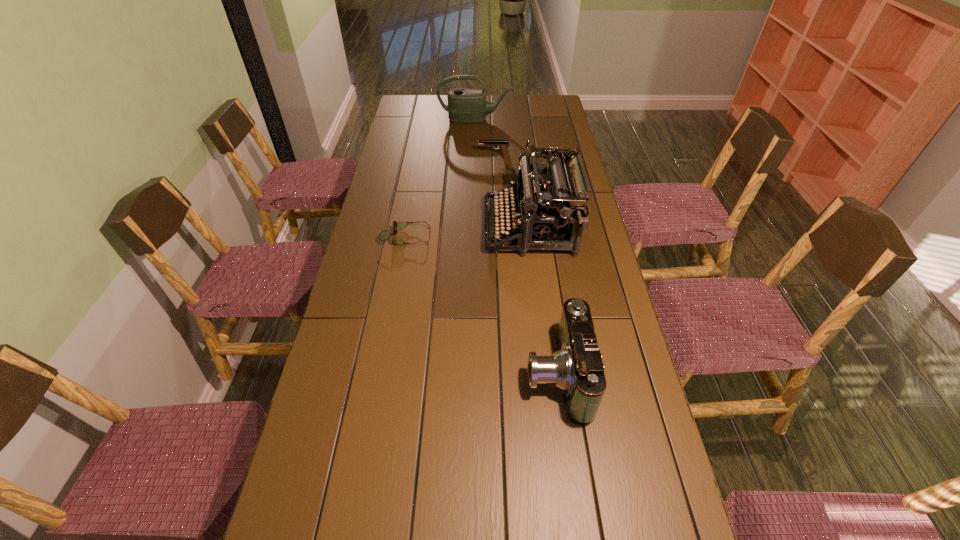
Where is `object present at the left edge`? This screenshot has width=960, height=540. object present at the left edge is located at coordinates (384, 235).

Find the location of `typewriter located at the right edge`. typewriter located at the right edge is located at coordinates (555, 212).

At what (x,y) coordinates should I click in order to perform the action: click on camcorder that is at the right edge. Please return your answer as a coordinate pair (x, y). This screenshot has width=960, height=540. Looking at the image, I should click on (576, 368).

Locate an element on the screen. free space at the far edge of the desktop is located at coordinates (529, 99).

You are a GUI agent. You are given a task and a screenshot of the screen. Output one action in this format:
    pyautogui.click(x=<x>, y=<y>)
    Task: Click on the vacant space at the left edge of the desktop
    The width and height of the screenshot is (960, 540).
    Given the screenshot: What is the action you would take?
    pyautogui.click(x=400, y=208)

The width and height of the screenshot is (960, 540). I want to click on free space at the right edge of the desktop, so click(x=565, y=281).

The image size is (960, 540). I want to click on free space between the typewriter and the spectacles, so tap(468, 232).

This screenshot has height=540, width=960. I want to click on empty space that is in between the fourth tallest object and the third tallest object, so click(x=525, y=266).

Where is `empty location between the spectacles and the third shortest object`? The height and width of the screenshot is (540, 960). empty location between the spectacles and the third shortest object is located at coordinates (481, 306).

Identify the location of vacant space that's between the shortest object and the typewriter. (468, 232).